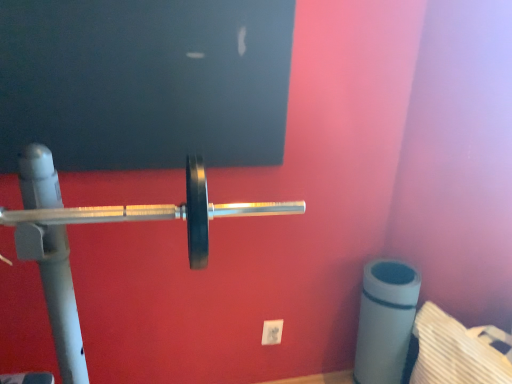
Question: Are polished silver barbell at center and white plastic power plug/socket at lower center beside each other?

Choices:
 (A) no
 (B) yes

Answer: (A)

Question: Can you confirm if polished silver barbell at center is smaller than white plastic power plug/socket at lower center?

Choices:
 (A) no
 (B) yes

Answer: (A)

Question: From the image's perspective, is polished silver barbell at center on top of white plastic power plug/socket at lower center?

Choices:
 (A) yes
 (B) no

Answer: (A)

Question: Does polished silver barbell at center have a lesser width compared to white plastic power plug/socket at lower center?

Choices:
 (A) yes
 (B) no

Answer: (B)

Question: Can you confirm if polished silver barbell at center is shorter than white plastic power plug/socket at lower center?

Choices:
 (A) yes
 (B) no

Answer: (B)

Question: Considering the relative sizes of polished silver barbell at center and white plastic power plug/socket at lower center in the image provided, is polished silver barbell at center bigger than white plastic power plug/socket at lower center?

Choices:
 (A) yes
 (B) no

Answer: (A)

Question: Does white plastic power plug/socket at lower center turn towards polished silver barbell at center?

Choices:
 (A) no
 (B) yes

Answer: (A)

Question: Is white plastic power plug/socket at lower center oriented away from polished silver barbell at center?

Choices:
 (A) yes
 (B) no

Answer: (B)

Question: Does white plastic power plug/socket at lower center have a lesser width compared to polished silver barbell at center?

Choices:
 (A) yes
 (B) no

Answer: (A)

Question: Are white plastic power plug/socket at lower center and polished silver barbell at center far apart?

Choices:
 (A) no
 (B) yes

Answer: (B)

Question: Can we say white plastic power plug/socket at lower center lies outside polished silver barbell at center?

Choices:
 (A) yes
 (B) no

Answer: (A)

Question: Can you confirm if white plastic power plug/socket at lower center is shorter than polished silver barbell at center?

Choices:
 (A) yes
 (B) no

Answer: (A)

Question: Considering their positions, is white plastic power plug/socket at lower center located in front of or behind polished silver barbell at center?

Choices:
 (A) front
 (B) behind

Answer: (B)